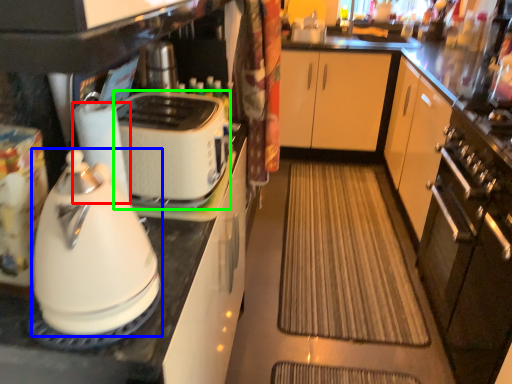
Question: Which object is the closest to the paper towel (highlighted by a red box)? Choose among these: kitchen appliance (highlighted by a blue box) or toaster (highlighted by a green box).

Choices:
 (A) kitchen appliance
 (B) toaster

Answer: (B)